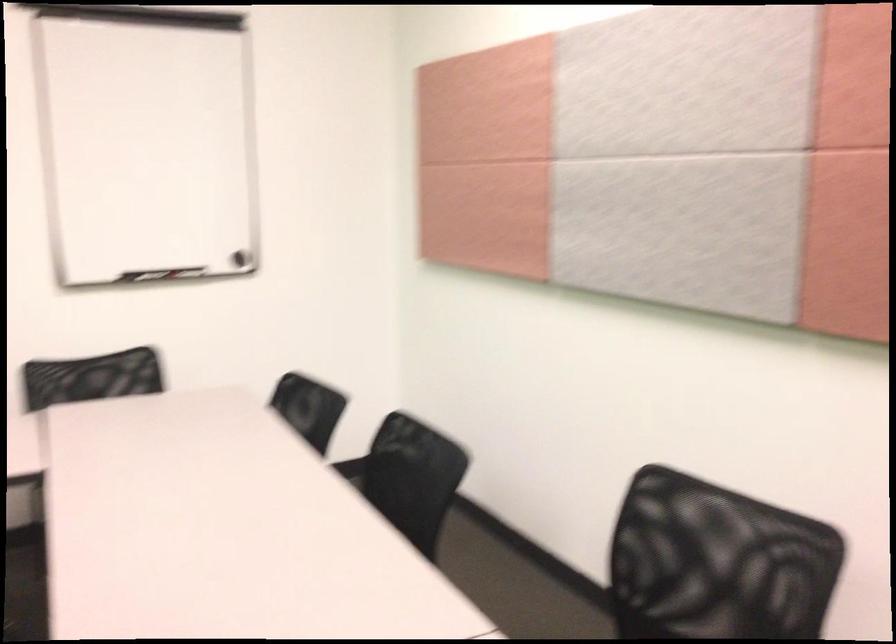
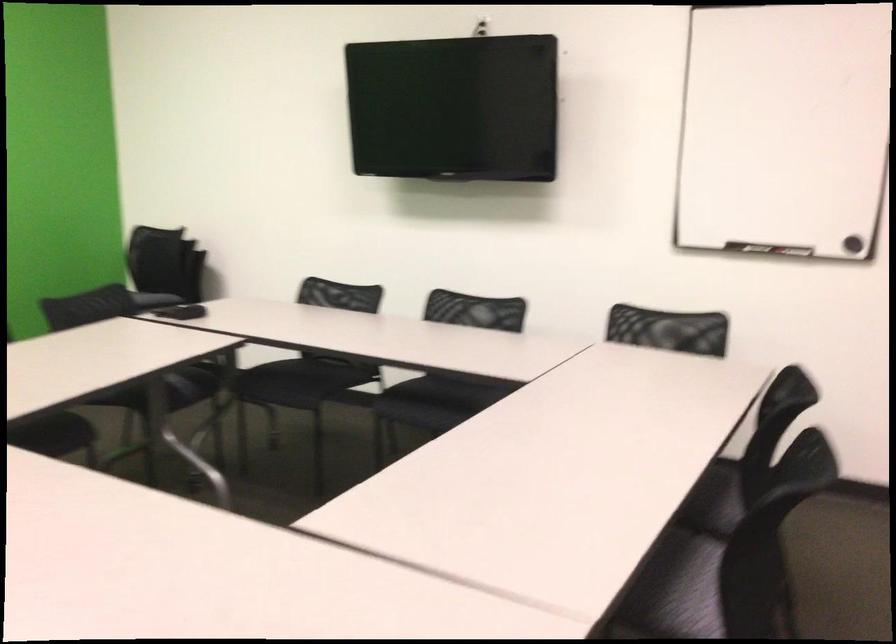
Locate, in the second image, the point that corresponds to (340,514) in the first image.

(722, 491)